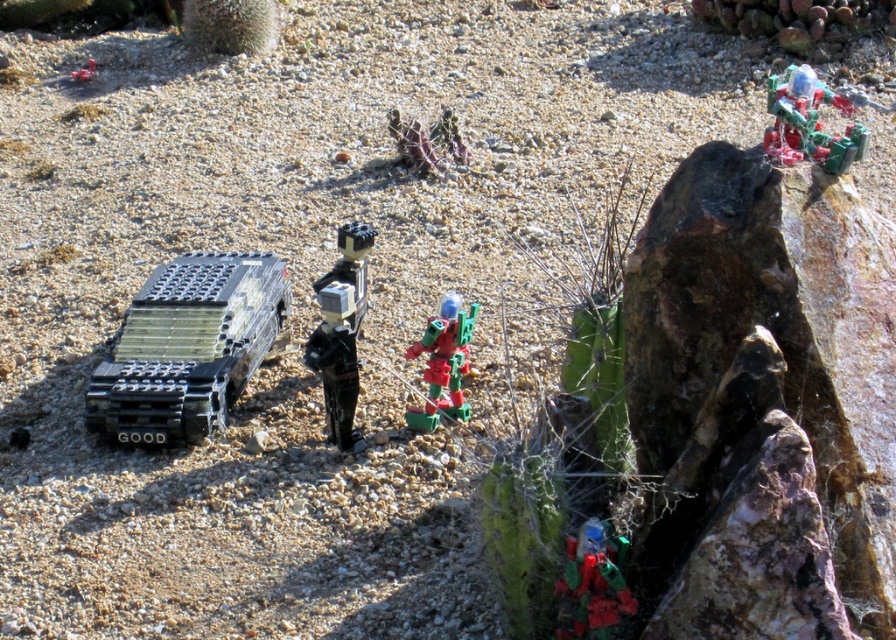
Which is more to the right, shiny metallic robot at lower right or smooth red toy at upper left?

shiny metallic robot at lower right

Is shiny metallic robot at lower right taller than smooth red toy at upper left?

Correct, shiny metallic robot at lower right is much taller as smooth red toy at upper left.

Where is `shiny metallic robot at lower right`? shiny metallic robot at lower right is located at coordinates (593, 580).

This screenshot has width=896, height=640. What do you see at coordinates (187, 346) in the screenshot?
I see `black plastic tank at left` at bounding box center [187, 346].

Can you confirm if black plastic tank at left is positioned to the left of shiny plastic robot at upper right?

Correct, you'll find black plastic tank at left to the left of shiny plastic robot at upper right.

In order to click on black plastic tank at left in this screenshot , I will do `click(187, 346)`.

Which is more to the right, black matte figure at center or green plastic cactus at center?

From the viewer's perspective, green plastic cactus at center appears more on the right side.

Where is `black matte figure at center`? The width and height of the screenshot is (896, 640). black matte figure at center is located at coordinates (340, 330).

You are a GUI agent. You are given a task and a screenshot of the screen. Output one action in this format:
    pyautogui.click(x=<x>, y=<y>)
    Task: Click on the black matte figure at center
    
    Given the screenshot: What is the action you would take?
    pyautogui.click(x=340, y=330)